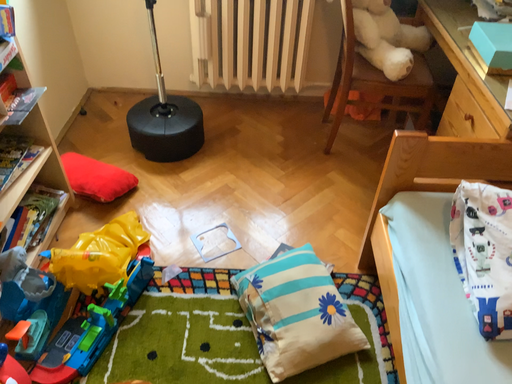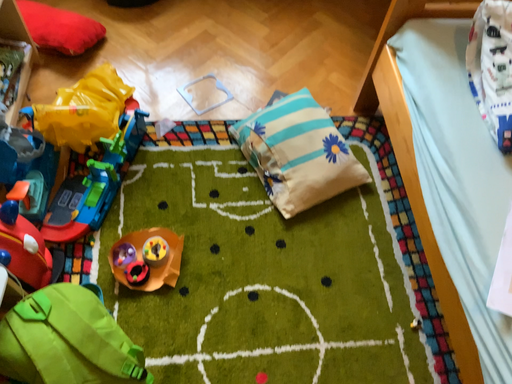
Question: Which way did the camera rotate in the video?

Choices:
 (A) rotated upward
 (B) rotated downward

Answer: (B)